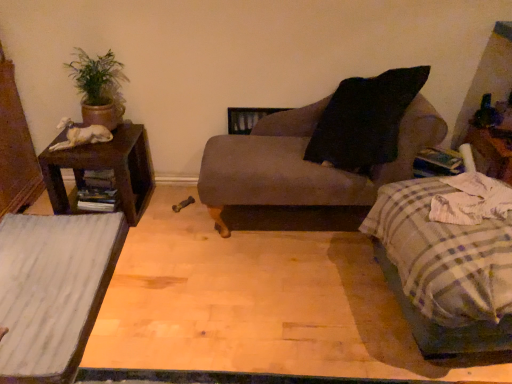
This screenshot has width=512, height=384. In order to click on vacant space to the right of brown wood nightstand at left in this screenshot , I will do `click(170, 216)`.